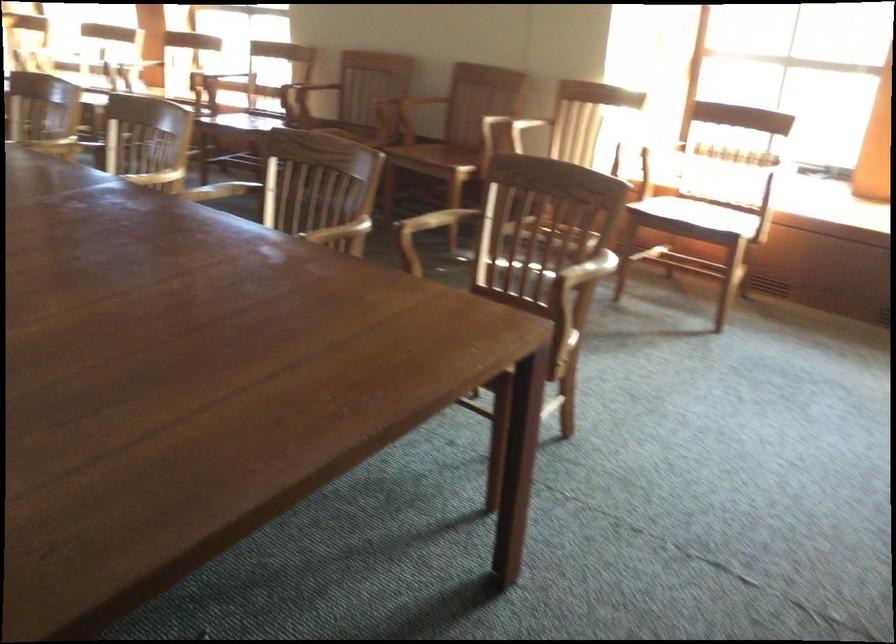
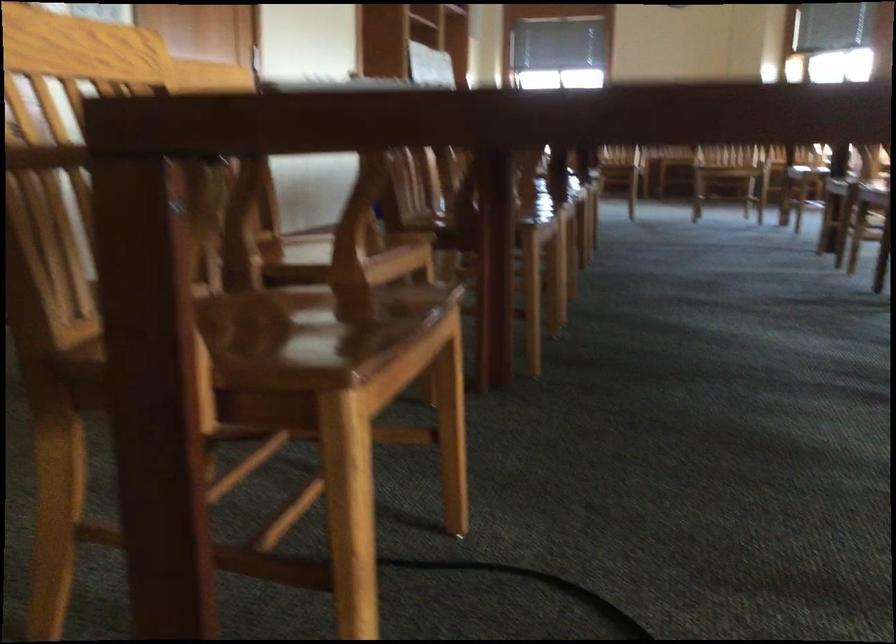
Question: The camera is either moving clockwise (left) or counter-clockwise (right) around the object. The first image is from the beginning of the video and the second image is from the end. Is the camera moving left or right when shooting the video?

Choices:
 (A) Left
 (B) Right

Answer: (B)